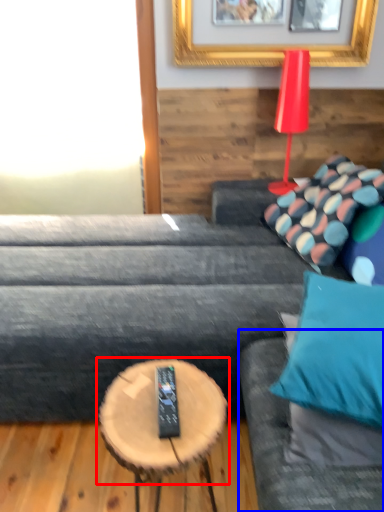
Question: Which object is closer to the camera taking this photo, coffee table (highlighted by a red box) or couch (highlighted by a blue box)?

Choices:
 (A) coffee table
 (B) couch

Answer: (B)